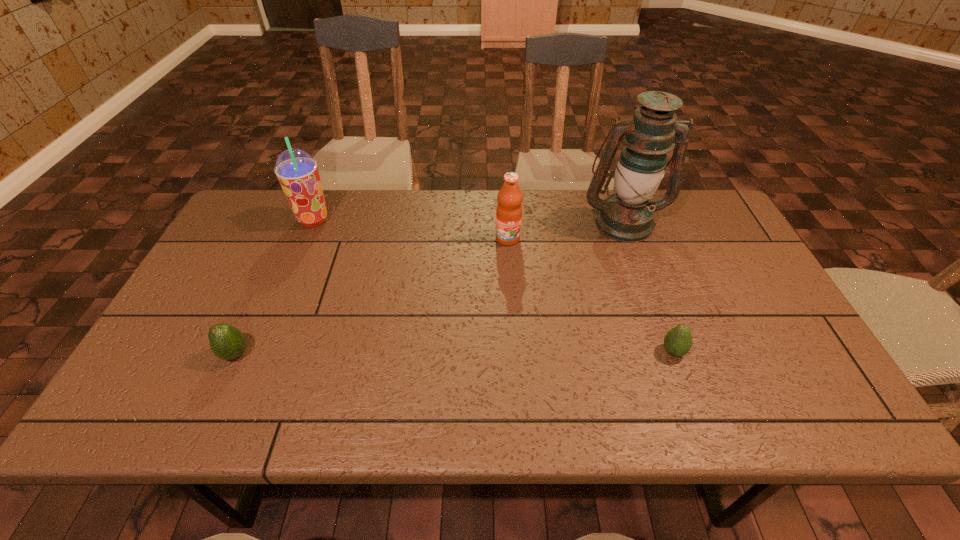
Find the location of a particular element. empty space between the fruit juice and the left avocado is located at coordinates (372, 296).

You are a GUI agent. You are given a task and a screenshot of the screen. Output one action in this format:
    pyautogui.click(x=<x>, y=<y>)
    Task: Click on the empty space that is in between the oil lamp and the fourth shortest object
    This screenshot has height=540, width=960.
    Given the screenshot: What is the action you would take?
    pyautogui.click(x=468, y=221)

Identify the location of free space between the third object from right to left and the smoothie. This screenshot has height=540, width=960. (411, 229).

Locate an element on the screen. The height and width of the screenshot is (540, 960). empty location between the right avocado and the left avocado is located at coordinates (454, 353).

This screenshot has width=960, height=540. In order to click on free space between the left avocado and the third object from left to right in this screenshot , I will do `click(372, 296)`.

Locate an element on the screen. The image size is (960, 540). free space between the left avocado and the third tallest object is located at coordinates (372, 296).

This screenshot has width=960, height=540. Find the location of `free area in between the left avocado and the right avocado`. free area in between the left avocado and the right avocado is located at coordinates (454, 353).

You are a GUI agent. You are given a task and a screenshot of the screen. Output one action in this format:
    pyautogui.click(x=<x>, y=<y>)
    Task: Click on the free area in between the left avocado and the right avocado
    The image size is (960, 540).
    Given the screenshot: What is the action you would take?
    pyautogui.click(x=454, y=353)

I want to click on free space between the tallest object and the smoothie, so click(468, 221).

Locate an element on the screen. The height and width of the screenshot is (540, 960). blank region between the left avocado and the right avocado is located at coordinates (454, 353).